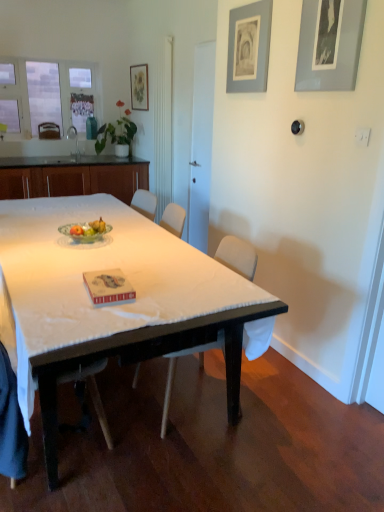
The image size is (384, 512). In order to click on vacant space in front of green glass bowl at center in this screenshot , I will do `click(72, 253)`.